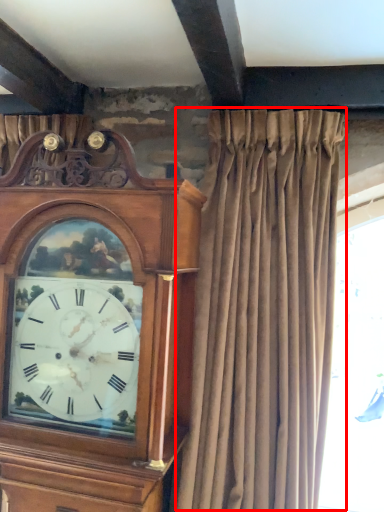
Question: From the image's perspective, what is the correct spatial positioning of curtain (annotated by the red box) in reference to clock?

Choices:
 (A) below
 (B) above

Answer: (B)